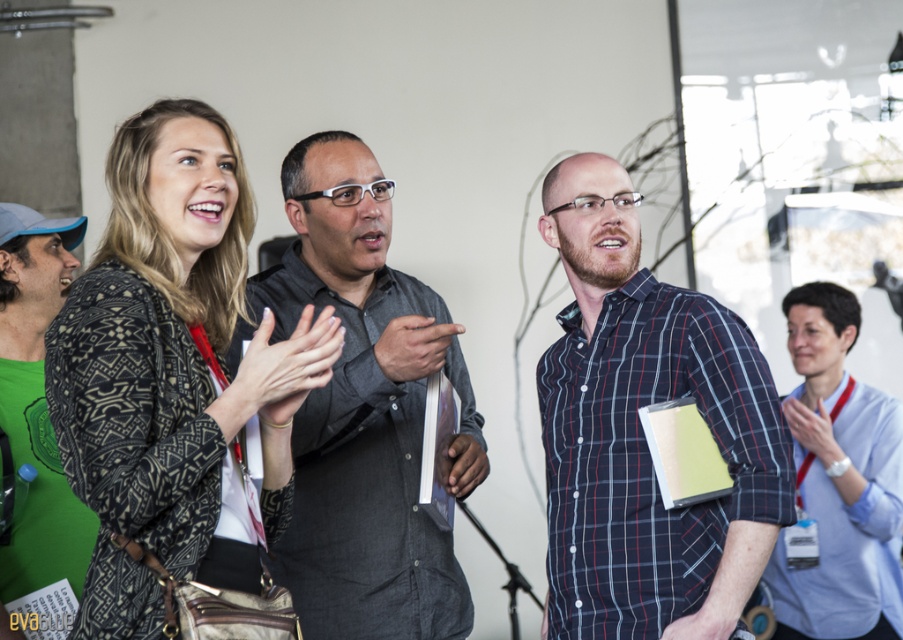
Question: Which point is closer to the camera taking this photo?

Choices:
 (A) (348, 381)
 (B) (276, 486)

Answer: (B)

Question: Estimate the real-world distances between objects in this image. Which object is closer to the patterned fabric jacket at center?

Choices:
 (A) green matte t-shirt at left
 (B) light blue shirt at right

Answer: (A)

Question: Is the position of dark gray shirt at center less distant than that of green matte t-shirt at left?

Choices:
 (A) yes
 (B) no

Answer: (A)

Question: Where is patterned fabric jacket at center located in relation to green matte t-shirt at left in the image?

Choices:
 (A) below
 (B) above

Answer: (B)

Question: Observing the image, what is the correct spatial positioning of patterned fabric jacket at center in reference to plaid cotton shirt at center?

Choices:
 (A) right
 (B) left

Answer: (B)

Question: Which point is closer to the camera?

Choices:
 (A) green matte t-shirt at left
 (B) patterned fabric jacket at center
 (C) light blue shirt at right

Answer: (B)